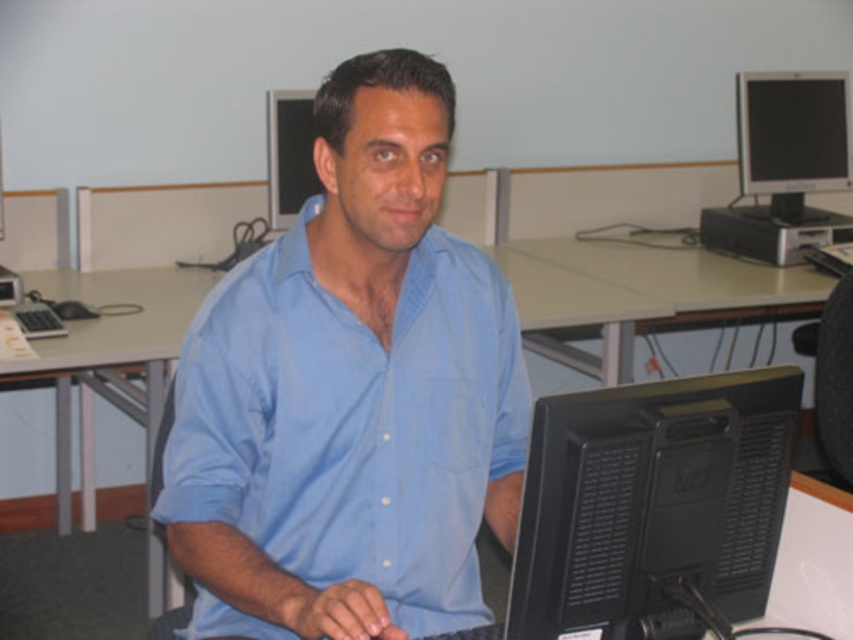
Question: Is black matte monitor at center below matte black monitor at upper center?

Choices:
 (A) no
 (B) yes

Answer: (B)

Question: Is black matte monitor at center to the right of black glossy monitor at upper right from the viewer's perspective?

Choices:
 (A) yes
 (B) no

Answer: (B)

Question: Among these points, which one is farthest from the camera?

Choices:
 (A) (289, 97)
 (B) (440, 365)
 (C) (833, 380)

Answer: (A)

Question: Which object is closer to the camera taking this photo?

Choices:
 (A) black fabric swivel chair at right
 (B) matte black monitor at upper center
 (C) blue cotton shirt at center

Answer: (C)

Question: Which object appears closest to the camera in this image?

Choices:
 (A) blue cotton shirt at center
 (B) black fabric swivel chair at right
 (C) black glossy monitor at upper right
 (D) black matte monitor at center

Answer: (A)

Question: Considering the relative positions of black matte monitor at center and black fabric swivel chair at right in the image provided, where is black matte monitor at center located with respect to black fabric swivel chair at right?

Choices:
 (A) below
 (B) above

Answer: (A)